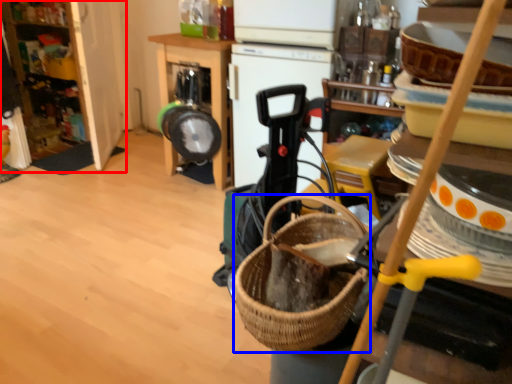
Question: Which of the following is the closest to the observer, cabinetry (highlighted by a red box) or basket (highlighted by a blue box)?

Choices:
 (A) cabinetry
 (B) basket

Answer: (B)